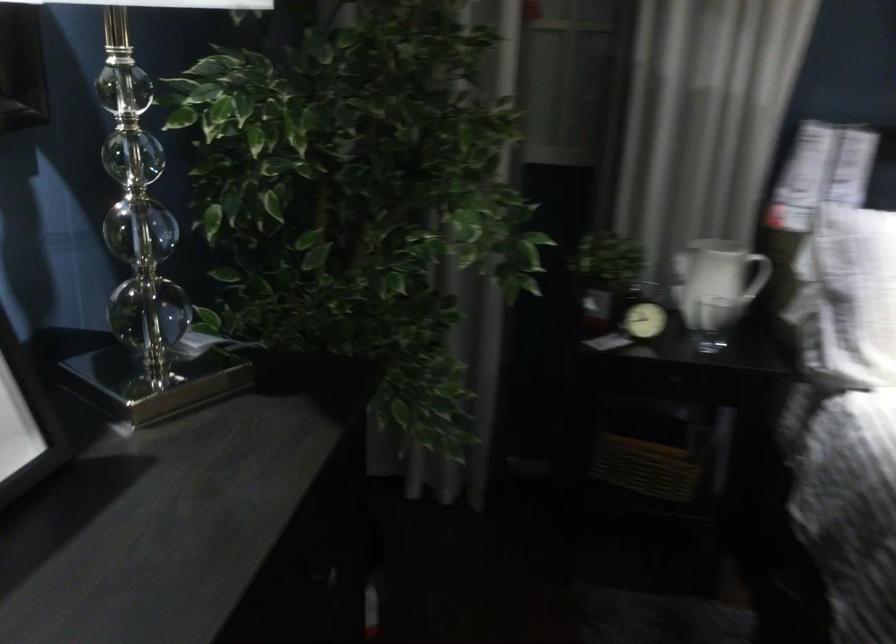
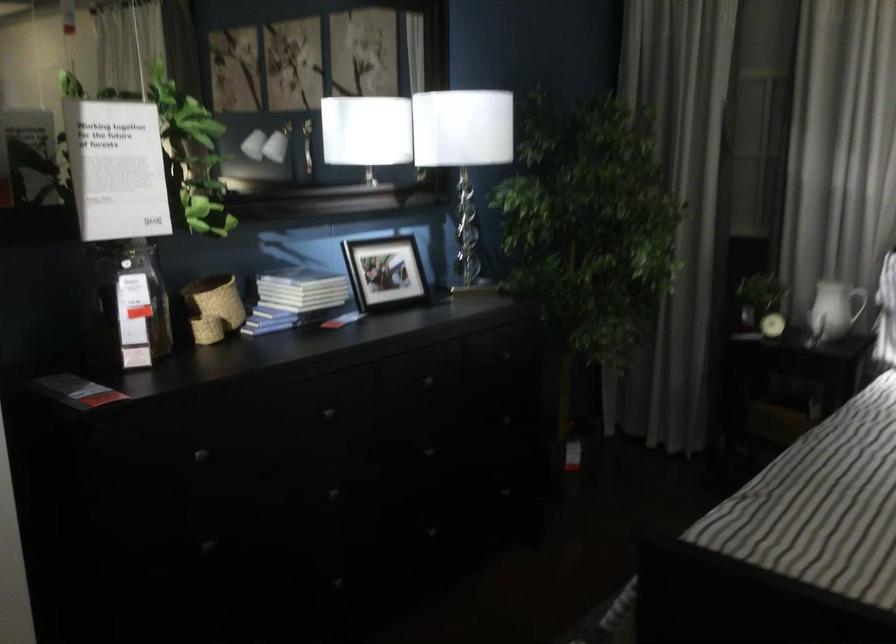
Where in the second image is the point corresponding to the point at 727,319 from the first image?

(823, 313)